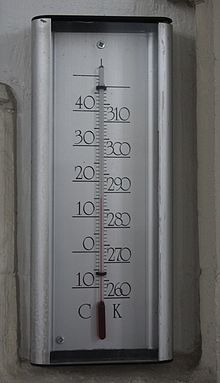
I want to click on wall corner, so [191, 338].